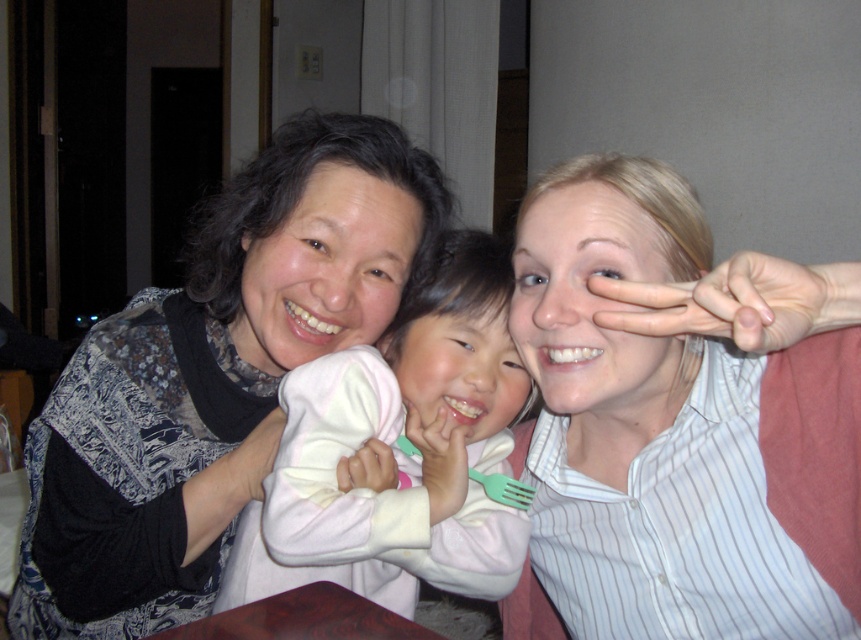
You are standing in the dining area and want to place a small plant between the two points marked as point [550,253] and point [499,499]. Which point should the plant be closer to in order to be positioned in front of both points?

The plant should be placed closer to point [550,253] because it is in front of point [499,499].

You are a photographer taking a picture of the group. To ensure the blonde hair at right and the green plastic fork at center are both in focus, which one should you adjust the camera focus closer to?

The photographer should focus closer to the green plastic fork at center because the blonde hair at right is positioned to the right of the green plastic fork at center, meaning the fork is closer to the camera.

You are a photographer trying to capture a candid shot of the scene. You want to ensure the matte black sweater at left and the green plastic fork at center are both visible in the frame. Based on their positions, which object is closer to the left edge of the photo?

The matte black sweater at left is to the left of the green plastic fork at center, so it is closer to the left edge of the photo.